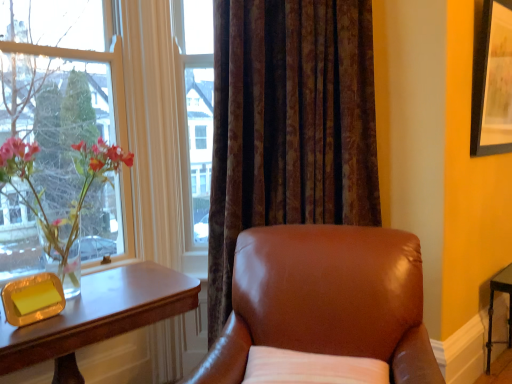
In order to face clear glass vase at left, should I rotate leftwards or rightwards?

Turn left by 23.375 degrees to look at clear glass vase at left.

At what (x,y) coordinates should I click in order to perform the action: click on clear glass vase at left. Please return your answer as a coordinate pair (x, y). The image size is (512, 384). Looking at the image, I should click on (56, 79).

What do you see at coordinates (98, 317) in the screenshot?
I see `wooden table at left` at bounding box center [98, 317].

Measure the distance between wooden table at left and camera.

The distance of wooden table at left from camera is 1.20 meters.

What is the approximate width of black matte picture frame at upper right?

It is 4.37 inches.

Describe the element at coordinates (492, 79) in the screenshot. Image resolution: width=512 pixels, height=384 pixels. I see `black matte picture frame at upper right` at that location.

Describe the element at coordinates (324, 309) in the screenshot. I see `brown leather chair at center` at that location.

Describe the element at coordinates (71, 202) in the screenshot. I see `translucent glass vase at left` at that location.

The height and width of the screenshot is (384, 512). What do you see at coordinates (311, 368) in the screenshot?
I see `white fabric pillow at lower center` at bounding box center [311, 368].

Where is `white fabric pillow at lower center`? The image size is (512, 384). white fabric pillow at lower center is located at coordinates (311, 368).

You are a GUI agent. You are given a task and a screenshot of the screen. Output one action in this format:
    pyautogui.click(x=<x>, y=<y>)
    Task: Click on the clear glass vase at left
    Image resolution: width=512 pixels, height=384 pixels.
    Given the screenshot: What is the action you would take?
    pyautogui.click(x=56, y=79)

Looking at this image, which of these two, brown textured curtain at center or black matte picture frame at upper right, is thinner?

black matte picture frame at upper right is thinner.

Considering the relative sizes of brown textured curtain at center and black matte picture frame at upper right in the image provided, is brown textured curtain at center smaller than black matte picture frame at upper right?

No.

From the image's perspective, is brown textured curtain at center on top of black matte picture frame at upper right?

No, from the image's perspective, brown textured curtain at center is not on top of black matte picture frame at upper right.

Looking at this image, considering the positions of objects brown textured curtain at center and black matte picture frame at upper right in the image provided, who is more to the left, brown textured curtain at center or black matte picture frame at upper right?

brown textured curtain at center.

Which object is thinner, wooden table at left or brown textured curtain at center?

Thinner between the two is brown textured curtain at center.

Is brown textured curtain at center surrounded by wooden table at left?

No, wooden table at left does not contain brown textured curtain at center.

Is wooden table at left facing towards brown textured curtain at center?

No, wooden table at left does not turn towards brown textured curtain at center.

From a real-world perspective, which is physically above, white fabric pillow at lower center or dark brown wood side table at lower right?

white fabric pillow at lower center, from a real-world perspective.

In the image, there is a white fabric pillow at lower center. At what (x,y) coordinates should I click in order to perform the action: click on side table below it (from a real-world perspective). Please return your answer as a coordinate pair (x, y). Looking at the image, I should click on [x=493, y=311].

Based on the photo, can you confirm if brown leather chair at center is thinner than dark brown wood side table at lower right?

No.

Can we say brown leather chair at center lies outside dark brown wood side table at lower right?

brown leather chair at center is positioned outside dark brown wood side table at lower right.

From a real-world perspective, is brown leather chair at center positioned above or below dark brown wood side table at lower right?

brown leather chair at center is situated higher than dark brown wood side table at lower right in the real world.

Which point is more distant from viewer, (393, 372) or (508, 284)?

The point (508, 284) is behind.

Between point (420, 330) and point (78, 308), which one is positioned behind?

The point (420, 330) is farther.

Considering the sizes of brown leather chair at center and wooden table at left in the image, is brown leather chair at center taller or shorter than wooden table at left?

Clearly, brown leather chair at center is taller compared to wooden table at left.

Is brown leather chair at center far away from wooden table at left?

No, brown leather chair at center is not far away from wooden table at left.

Is brown leather chair at center touching white fabric pillow at lower center?

brown leather chair at center is not next to white fabric pillow at lower center, and they're not touching.

Could white fabric pillow at lower center be considered to be inside brown leather chair at center?

Yes, white fabric pillow at lower center is inside brown leather chair at center.

Considering the relative sizes of brown leather chair at center and white fabric pillow at lower center in the image provided, is brown leather chair at center wider than white fabric pillow at lower center?

Yes, brown leather chair at center is wider than white fabric pillow at lower center.

Considering the relative sizes of brown leather chair at center and white fabric pillow at lower center in the image provided, is brown leather chair at center bigger than white fabric pillow at lower center?

Yes, brown leather chair at center is bigger than white fabric pillow at lower center.

Which is more to the right, white fabric pillow at lower center or wooden table at left?

Positioned to the right is white fabric pillow at lower center.

Does white fabric pillow at lower center have a lesser width compared to wooden table at left?

Indeed, white fabric pillow at lower center has a lesser width compared to wooden table at left.

From a real-world perspective, between white fabric pillow at lower center and wooden table at left, who is vertically higher?

white fabric pillow at lower center, from a real-world perspective.

In terms of height, does white fabric pillow at lower center look taller or shorter compared to wooden table at left?

Considering their sizes, white fabric pillow at lower center has less height than wooden table at left.

What are the coordinates of `curtain behind the black matte picture frame at upper right` in the screenshot? It's located at (289, 125).

In the image, there is a brown textured curtain at center. Identify the location of table below it (from a real-world perspective). The image size is (512, 384). (98, 317).

Looking at the image, which one is located closer to translucent glass vase at left, black matte picture frame at upper right or wooden table at left?

wooden table at left.

When comparing their distances from black matte picture frame at upper right, does translucent glass vase at left or white fabric pillow at lower center seem further?

translucent glass vase at left.

Considering their positions, is translucent glass vase at left positioned closer to brown leather chair at center than white fabric pillow at lower center?

white fabric pillow at lower center lies closer to brown leather chair at center than the other object.

From the image, which object appears to be farther from translucent glass vase at left, black matte picture frame at upper right or brown textured curtain at center?

Among the two, black matte picture frame at upper right is located further to translucent glass vase at left.

When comparing their distances from white fabric pillow at lower center, does dark brown wood side table at lower right or brown leather chair at center seem closer?

→ brown leather chair at center is closer to white fabric pillow at lower center.

When comparing their distances from brown textured curtain at center, does black matte picture frame at upper right or clear glass vase at left seem closer?

black matte picture frame at upper right lies closer to brown textured curtain at center than the other object.

Estimate the real-world distances between objects in this image. Which object is closer to wooden table at left, brown textured curtain at center or brown leather chair at center?

brown leather chair at center.

Considering their positions, is brown leather chair at center positioned closer to wooden table at left than white fabric pillow at lower center?

The object closer to wooden table at left is brown leather chair at center.

The image size is (512, 384). Identify the location of pillow between brown textured curtain at center and wooden table at left in the vertical direction. (311, 368).

Identify the location of picture frame between clear glass vase at left and dark brown wood side table at lower right in the horizontal direction. (492, 79).

The height and width of the screenshot is (384, 512). I want to click on pillow situated between brown textured curtain at center and black matte picture frame at upper right from left to right, so click(x=311, y=368).

I want to click on pillow between black matte picture frame at upper right and dark brown wood side table at lower right from top to bottom, so [x=311, y=368].